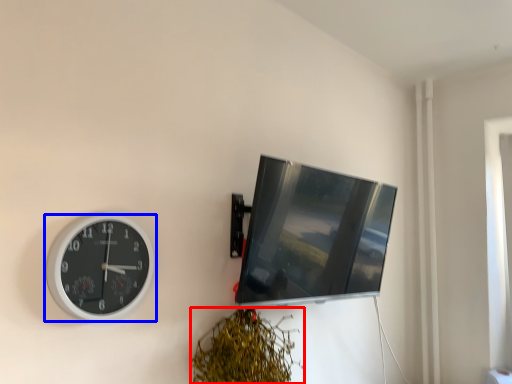
Question: Which point is closer to the camera, vegetation (highlighted by a red box) or wall clock (highlighted by a blue box)?

Choices:
 (A) vegetation
 (B) wall clock

Answer: (B)